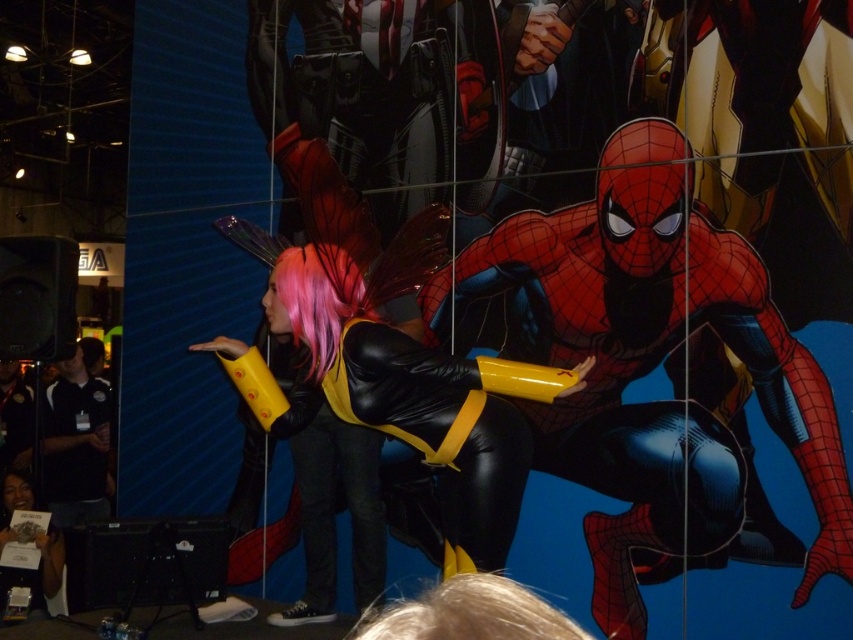
Does point (316, 253) come in front of point (100, 410)?

Yes, it is.

Which is in front, point (495, 372) or point (74, 369)?

Positioned in front is point (495, 372).

Find the location of a particular element. The width and height of the screenshot is (853, 640). black matte/yellow leather gloves at center is located at coordinates (421, 404).

Does red matte spider-man at center have a larger size compared to black matte/yellow leather gloves at center?

Yes, red matte spider-man at center is bigger than black matte/yellow leather gloves at center.

Is red matte spider-man at center positioned behind black matte/yellow leather gloves at center?

Yes, red matte spider-man at center is behind black matte/yellow leather gloves at center.

Does point (641, 120) come in front of point (381, 349)?

No, (641, 120) is behind (381, 349).

Image resolution: width=853 pixels, height=640 pixels. I want to click on red matte spider-man at center, so click(x=648, y=369).

Is point (517, 227) positioned behind point (51, 428)?

No, (517, 227) is in front of (51, 428).

Can you confirm if red matte spider-man at center is smaller than black jersey at left?

No, red matte spider-man at center is not smaller than black jersey at left.

Does point (634, 180) come in front of point (62, 481)?

Yes, point (634, 180) is in front of point (62, 481).

You are a GUI agent. You are given a task and a screenshot of the screen. Output one action in this format:
    pyautogui.click(x=<x>, y=<y>)
    Task: Click on the red matte spider-man at center
    
    Given the screenshot: What is the action you would take?
    pyautogui.click(x=648, y=369)